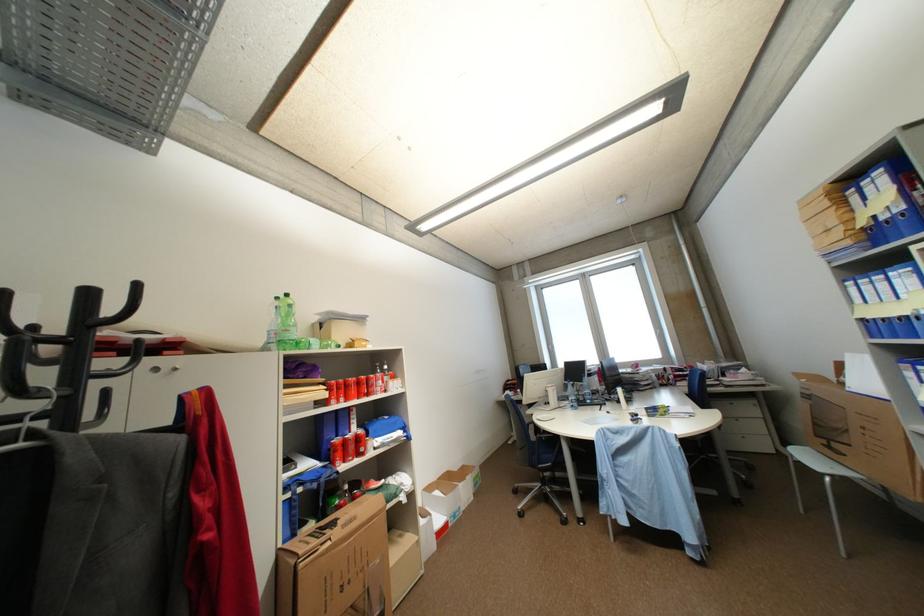
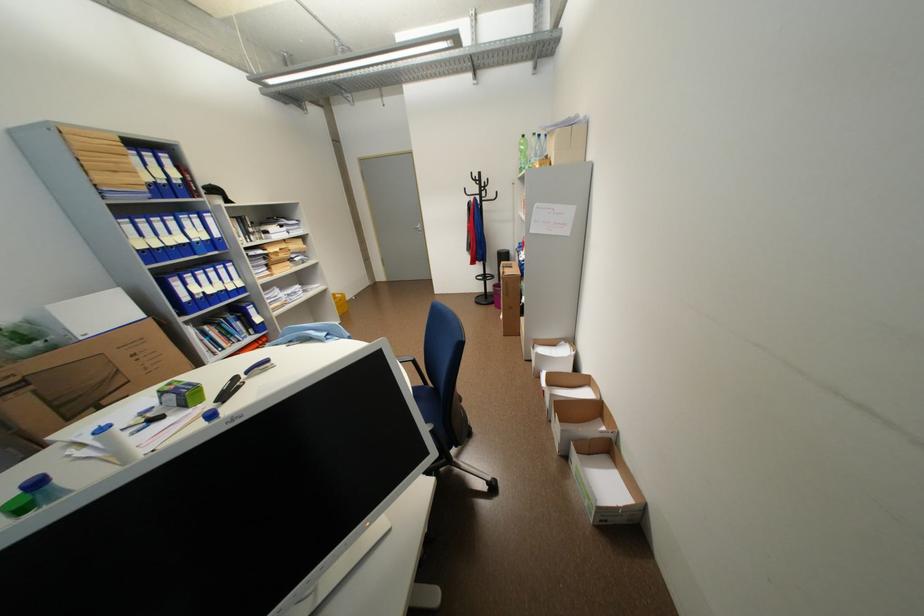
Find the pixel in the second image that matches (296,296) in the first image.

(531, 137)